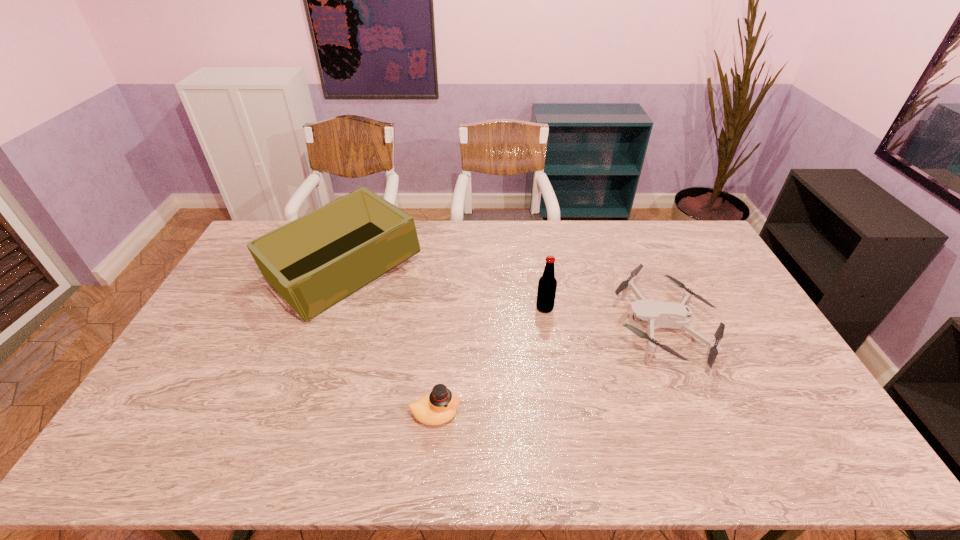
Where is `vacant space located with a camera at the front of the rightmost object`? vacant space located with a camera at the front of the rightmost object is located at coordinates (568, 327).

Find the location of a particular element. The height and width of the screenshot is (540, 960). object that is at the far edge is located at coordinates [x=314, y=262].

Find the location of a particular element. object present at the left edge is located at coordinates (314, 262).

Find the location of a particular element. The image size is (960, 540). object positioned at the right edge is located at coordinates (655, 314).

Identify the location of object that is positioned at the far left corner. click(314, 262).

Find the location of a particular element. The width and height of the screenshot is (960, 540). vacant space at the far edge of the desktop is located at coordinates coord(515,237).

Locate an element on the screen. The height and width of the screenshot is (540, 960). vacant space at the left edge of the desktop is located at coordinates (232, 334).

Where is `free region at the right edge`? free region at the right edge is located at coordinates (815, 420).

Locate an element on the screen. This screenshot has height=540, width=960. vacant area that lies between the third object from right to left and the rightmost object is located at coordinates (548, 370).

You are a GUI agent. You are given a task and a screenshot of the screen. Output one action in this format:
    pyautogui.click(x=<x>, y=<y>)
    Task: Click on the free spot between the beer bottle and the box
    This screenshot has width=960, height=540.
    Given the screenshot: What is the action you would take?
    [x=444, y=289]